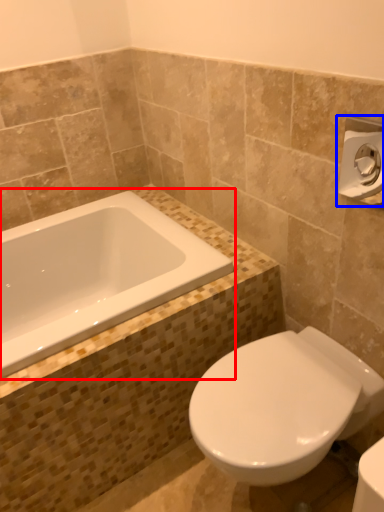
Question: Which of the following is the closest to the observer, bathtub (highlighted by a red box) or towel bar (highlighted by a blue box)?

Choices:
 (A) bathtub
 (B) towel bar

Answer: (B)